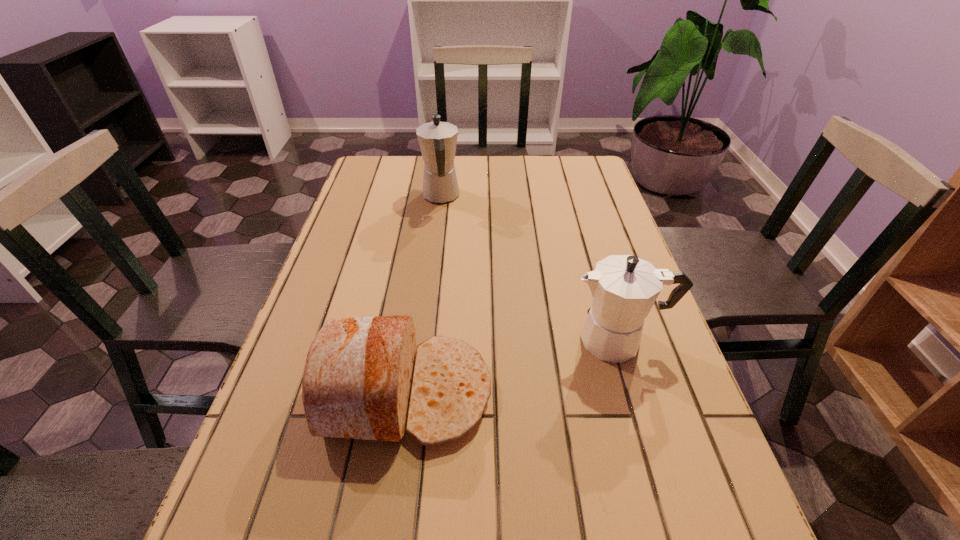
In order to click on vacant area that lies between the shortest object and the right coffeepot in this screenshot , I will do `click(512, 366)`.

The image size is (960, 540). I want to click on free space that is in between the farther coffeepot and the shortest object, so click(423, 294).

At what (x,y) coordinates should I click in order to perform the action: click on empty space between the nearer coffeepot and the farthest object. Please return your answer as a coordinate pair (x, y). Image resolution: width=960 pixels, height=540 pixels. Looking at the image, I should click on (530, 268).

Locate an element on the screen. vacant area that lies between the farthest object and the bread is located at coordinates (423, 294).

Find the location of a particular element. This screenshot has height=540, width=960. empty space between the nearer coffeepot and the farther coffeepot is located at coordinates point(530,268).

This screenshot has width=960, height=540. In order to click on vacant area that lies between the bread and the nearer coffeepot in this screenshot , I will do `click(512, 366)`.

The width and height of the screenshot is (960, 540). Find the location of `free space between the farthest object and the bread`. free space between the farthest object and the bread is located at coordinates (423, 294).

Find the location of a particular element. The width and height of the screenshot is (960, 540). free area in between the shortest object and the left coffeepot is located at coordinates (423, 294).

Locate which object is the closest to the left coffeepot. Please provide its 2D coordinates. Your answer should be formatted as a tuple, i.e. [(x, y)], where the tuple contains the x and y coordinates of a point satisfying the conditions above.

[(357, 379)]

Identify which object is located as the nearest to the bread. Please provide its 2D coordinates. Your answer should be formatted as a tuple, i.e. [(x, y)], where the tuple contains the x and y coordinates of a point satisfying the conditions above.

[(624, 288)]